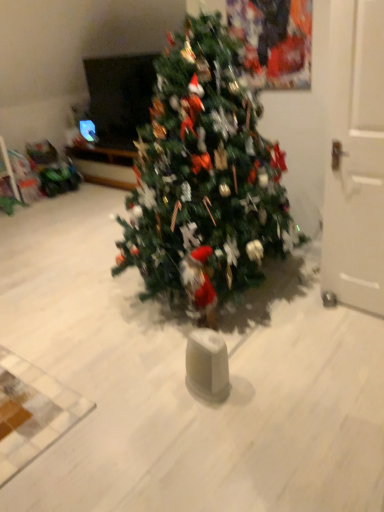
Question: Should I look upward or downward to see green matte christmas tree at center?

Choices:
 (A) up
 (B) down

Answer: (A)

Question: Is white matte door at right shorter than green matte christmas tree at center?

Choices:
 (A) yes
 (B) no

Answer: (A)

Question: Is white matte door at right oriented away from green matte christmas tree at center?

Choices:
 (A) no
 (B) yes

Answer: (A)

Question: Considering the relative positions of white matte door at right and green matte christmas tree at center in the image provided, is white matte door at right to the right of green matte christmas tree at center from the viewer's perspective?

Choices:
 (A) yes
 (B) no

Answer: (A)

Question: Does white matte door at right have a smaller size compared to green matte christmas tree at center?

Choices:
 (A) yes
 (B) no

Answer: (A)

Question: From the image's perspective, would you say white matte door at right is positioned over green matte christmas tree at center?

Choices:
 (A) no
 (B) yes

Answer: (A)

Question: Does white matte door at right have a lesser width compared to green matte christmas tree at center?

Choices:
 (A) yes
 (B) no

Answer: (A)

Question: Is green matte christmas tree at center oriented towards white matte door at right?

Choices:
 (A) no
 (B) yes

Answer: (A)

Question: Can you confirm if green matte christmas tree at center is thinner than white matte door at right?

Choices:
 (A) yes
 (B) no

Answer: (B)

Question: Is green matte christmas tree at center located outside white matte door at right?

Choices:
 (A) yes
 (B) no

Answer: (A)

Question: Are green matte christmas tree at center and white matte door at right far apart?

Choices:
 (A) no
 (B) yes

Answer: (A)

Question: Considering the relative positions of green matte christmas tree at center and white matte door at right in the image provided, is green matte christmas tree at center to the right of white matte door at right from the viewer's perspective?

Choices:
 (A) no
 (B) yes

Answer: (A)

Question: Is green matte christmas tree at center further to the viewer compared to white matte door at right?

Choices:
 (A) yes
 (B) no

Answer: (B)

Question: In terms of height, does white matte door at right look taller or shorter compared to green matte christmas tree at center?

Choices:
 (A) tall
 (B) short

Answer: (B)